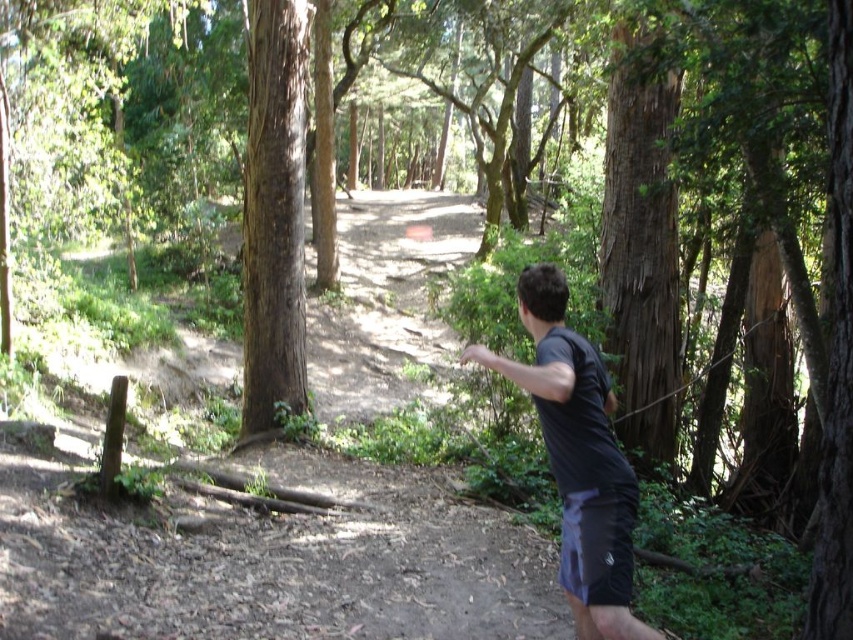
Question: Which point is closer to the camera taking this photo?

Choices:
 (A) (556, 422)
 (B) (291, 403)

Answer: (A)

Question: Which object is closer to the camera taking this photo?

Choices:
 (A) dark gray t-shirt at center
 (B) brown rough bark tree at center

Answer: (A)

Question: Is dark gray t-shirt at center thinner than brown rough bark tree at center?

Choices:
 (A) yes
 (B) no

Answer: (A)

Question: Can you confirm if dark gray t-shirt at center is thinner than brown rough bark tree at center?

Choices:
 (A) no
 (B) yes

Answer: (B)

Question: Is the position of dark gray t-shirt at center more distant than that of brown rough bark tree at center?

Choices:
 (A) no
 (B) yes

Answer: (A)